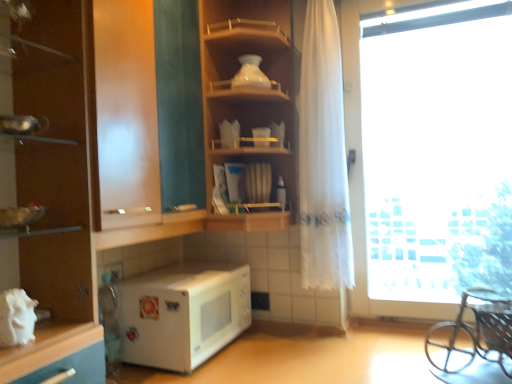
What is the approximate height of metallic silver baby carriage at lower right?

metallic silver baby carriage at lower right is 10.20 inches tall.

What are the coordinates of `transparent glass window at right` in the screenshot? It's located at (362, 172).

You are a GUI agent. You are given a task and a screenshot of the screen. Output one action in this format:
    pyautogui.click(x=<x>, y=<y>)
    Task: Click on the white matte microwave at lower left
    This screenshot has width=512, height=384.
    Given the screenshot: What is the action you would take?
    pyautogui.click(x=182, y=313)

Locate an element on the screen. The height and width of the screenshot is (384, 512). transparent glass shelves at upper left, the second shelf in the right-to-left sequence is located at coordinates (185, 227).

Describe the element at coordinates (323, 158) in the screenshot. I see `white sheer curtain at right` at that location.

Identify the location of metallic silver baby carriage at lower right. This screenshot has height=384, width=512. (473, 334).

From the image's perspective, which one is positioned higher, transparent glass shelves at upper left, the second shelf in the right-to-left sequence, or matte brown cabinet at left?

From the image's view, transparent glass shelves at upper left, the second shelf in the right-to-left sequence, is above.

Between transparent glass shelves at upper left, marked as the first shelf in a left-to-right arrangement, and matte brown cabinet at left, which one has smaller size?

matte brown cabinet at left is smaller.

From the picture: Is transparent glass shelves at upper left, marked as the first shelf in a left-to-right arrangement, closer to the viewer compared to matte brown cabinet at left?

No, it is not.

Could you tell me if transparent glass shelves at upper left, the second shelf in the right-to-left sequence, is turned towards matte brown cabinet at left?

No, transparent glass shelves at upper left, the second shelf in the right-to-left sequence, is not facing towards matte brown cabinet at left.

Considering the points (323, 122) and (476, 321), which point is behind, point (323, 122) or point (476, 321)?

The point (323, 122) is behind.

From the image's perspective, would you say white sheer curtain at right is shown under metallic silver baby carriage at lower right?

No.

Is white sheer curtain at right completely or partially outside of metallic silver baby carriage at lower right?

Yes, white sheer curtain at right is located beyond the bounds of metallic silver baby carriage at lower right.

Can you confirm if white glossy vase at upper center is wider than transparent glass shelves at upper left, the second shelf in the right-to-left sequence?

In fact, white glossy vase at upper center might be narrower than transparent glass shelves at upper left, the second shelf in the right-to-left sequence.

Based on the photo, could you tell me if white glossy vase at upper center is turned towards transparent glass shelves at upper left, marked as the first shelf in a left-to-right arrangement?

No, white glossy vase at upper center is not aimed at transparent glass shelves at upper left, marked as the first shelf in a left-to-right arrangement.

Is matte brown cabinet at left next to metallic silver baby carriage at lower right and touching it?

No, matte brown cabinet at left is not next to metallic silver baby carriage at lower right.

The height and width of the screenshot is (384, 512). I want to click on cabinetry in front of the metallic silver baby carriage at lower right, so click(x=53, y=193).

Considering the relative sizes of matte brown cabinet at left and metallic silver baby carriage at lower right in the image provided, is matte brown cabinet at left bigger than metallic silver baby carriage at lower right?

Correct, matte brown cabinet at left is larger in size than metallic silver baby carriage at lower right.

Considering the sizes of objects transparent glass shelves at upper left, marked as the first shelf in a left-to-right arrangement, and metallic silver baby carriage at lower right in the image provided, who is bigger, transparent glass shelves at upper left, marked as the first shelf in a left-to-right arrangement, or metallic silver baby carriage at lower right?

transparent glass shelves at upper left, marked as the first shelf in a left-to-right arrangement, is bigger.

Does transparent glass shelves at upper left, marked as the first shelf in a left-to-right arrangement, come in front of metallic silver baby carriage at lower right?

That is True.

From a real-world perspective, is transparent glass shelves at upper left, the second shelf in the right-to-left sequence, under metallic silver baby carriage at lower right?

Actually, transparent glass shelves at upper left, the second shelf in the right-to-left sequence, is physically above metallic silver baby carriage at lower right in the real world.

From the picture: How far apart are transparent glass shelves at upper left, marked as the first shelf in a left-to-right arrangement, and metallic silver baby carriage at lower right?

89.99 centimeters.

From the image's perspective, which object appears higher, white glossy vase at upper center or transparent glass window at right?

white glossy vase at upper center, from the image's perspective.

Looking at this image, considering the sizes of white glossy vase at upper center and transparent glass window at right in the image, is white glossy vase at upper center bigger or smaller than transparent glass window at right?

white glossy vase at upper center is smaller than transparent glass window at right.

In terms of width, does white glossy vase at upper center look wider or thinner when compared to transparent glass window at right?

white glossy vase at upper center is thinner than transparent glass window at right.

The image size is (512, 384). What are the coordinates of `window below the white glossy vase at upper center (from a real-world perspective)` in the screenshot? It's located at (362, 172).

Can you confirm if white glossy vase at upper center is smaller than wooden shelf at center, which appears as the first shelf when viewed from the right?

Yes.

From a real-world perspective, is white glossy vase at upper center over wooden shelf at center, which ranks as the 2th shelf in left-to-right order?

Indeed, from a real-world perspective, white glossy vase at upper center stands above wooden shelf at center, which ranks as the 2th shelf in left-to-right order.

How different are the orientations of white glossy vase at upper center and wooden shelf at center, which appears as the first shelf when viewed from the right, in degrees?

The angular difference between white glossy vase at upper center and wooden shelf at center, which appears as the first shelf when viewed from the right, is 47.8 degrees.

Is white glossy vase at upper center positioned far away from wooden shelf at center, which appears as the first shelf when viewed from the right?

That's not correct — white glossy vase at upper center is a little close to wooden shelf at center, which appears as the first shelf when viewed from the right.

This screenshot has height=384, width=512. Find the location of `shelf that is the 1st object located behind the matte brown cabinet at left`. shelf that is the 1st object located behind the matte brown cabinet at left is located at coordinates (185, 227).

The height and width of the screenshot is (384, 512). In order to click on baby carriage on the right of white sheer curtain at right in this screenshot , I will do `click(473, 334)`.

From the image, which object appears to be farther from white sheer curtain at right, transparent glass shelves at upper left, the second shelf in the right-to-left sequence, or wooden shelf at center, which ranks as the 2th shelf in left-to-right order?

Among the two, transparent glass shelves at upper left, the second shelf in the right-to-left sequence, is located further to white sheer curtain at right.

When comparing their distances from wooden shelf at center, which ranks as the 2th shelf in left-to-right order, does white sheer curtain at right or white matte microwave at lower left seem further?

white matte microwave at lower left lies further to wooden shelf at center, which ranks as the 2th shelf in left-to-right order, than the other object.

When comparing their distances from white glossy vase at upper center, does wooden shelf at center, which appears as the first shelf when viewed from the right, or matte brown cabinet at left seem further?

matte brown cabinet at left.

Looking at the image, which one is located further to white sheer curtain at right, white glossy vase at upper center or white matte microwave at lower left?

white matte microwave at lower left.

Consider the image. From the image, which object appears to be nearer to white matte microwave at lower left, transparent glass window at right or transparent glass shelves at upper left, the second shelf in the right-to-left sequence?

transparent glass shelves at upper left, the second shelf in the right-to-left sequence, lies closer to white matte microwave at lower left than the other object.

Looking at the image, which one is located further to metallic silver baby carriage at lower right, wooden shelf at center, which ranks as the 2th shelf in left-to-right order, or transparent glass window at right?

Based on the image, wooden shelf at center, which ranks as the 2th shelf in left-to-right order, appears to be further to metallic silver baby carriage at lower right.

From the image, which object appears to be farther from transparent glass window at right, metallic silver baby carriage at lower right or white matte microwave at lower left?

Among the two, white matte microwave at lower left is located further to transparent glass window at right.

From the image, which object appears to be farther from wooden shelf at center, which ranks as the 2th shelf in left-to-right order, transparent glass shelves at upper left, marked as the first shelf in a left-to-right arrangement, or white matte microwave at lower left?

white matte microwave at lower left is further to wooden shelf at center, which ranks as the 2th shelf in left-to-right order.

The image size is (512, 384). I want to click on shelf between transparent glass shelves at upper left, the second shelf in the right-to-left sequence, and transparent glass window at right from left to right, so click(247, 94).

Where is `cabinetry between transparent glass shelves at upper left, the second shelf in the right-to-left sequence, and white matte microwave at lower left from top to bottom`? cabinetry between transparent glass shelves at upper left, the second shelf in the right-to-left sequence, and white matte microwave at lower left from top to bottom is located at coordinates (53, 193).

Locate an element on the screen. Image resolution: width=512 pixels, height=384 pixels. window between wooden shelf at center, which appears as the first shelf when viewed from the right, and metallic silver baby carriage at lower right, in the vertical direction is located at coordinates (362, 172).

Where is `appliance between matte brown cabinet at left and white sheer curtain at right`? appliance between matte brown cabinet at left and white sheer curtain at right is located at coordinates (250, 74).